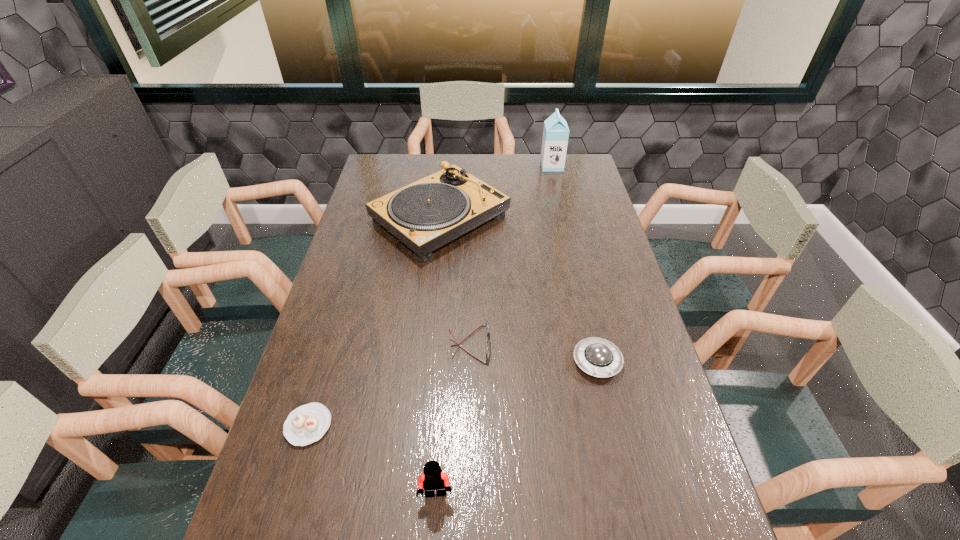
The width and height of the screenshot is (960, 540). In order to click on vacant point at the far edge in this screenshot , I will do `click(492, 154)`.

The image size is (960, 540). Identify the location of vacant position at the left edge of the desktop. (313, 393).

Locate an element on the screen. The image size is (960, 540). vacant space at the right edge of the desktop is located at coordinates (615, 264).

Find the location of a particular element. Image resolution: width=960 pixels, height=540 pixels. vacant space at the far right corner of the desktop is located at coordinates (587, 168).

Locate an element on the screen. empty space that is in between the nearest object and the milk carton is located at coordinates tap(494, 330).

Image resolution: width=960 pixels, height=540 pixels. I want to click on free spot between the second nearest object and the fifth nearest object, so click(x=374, y=322).

This screenshot has height=540, width=960. Find the location of `vacant area between the Lego and the cupcake`. vacant area between the Lego and the cupcake is located at coordinates (372, 460).

At what (x,y) coordinates should I click in order to perform the action: click on free area in between the milk carton and the spectacles. Please return your answer as a coordinate pair (x, y). This screenshot has width=960, height=540. Looking at the image, I should click on (511, 255).

Where is `unoccupied area between the fifth nearest object and the Lego`? unoccupied area between the fifth nearest object and the Lego is located at coordinates (438, 356).

You are a GUI agent. You are given a task and a screenshot of the screen. Output one action in this format:
    pyautogui.click(x=<x>, y=<y>)
    Task: Click on the vacant area that lies between the third shortest object and the second farthest object
    
    Given the screenshot: What is the action you would take?
    pyautogui.click(x=518, y=290)